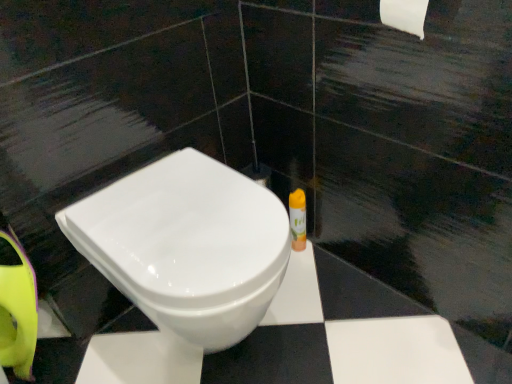
The height and width of the screenshot is (384, 512). What are the coordinates of `free point in front of yellow plastic spray can at right` in the screenshot? It's located at (313, 281).